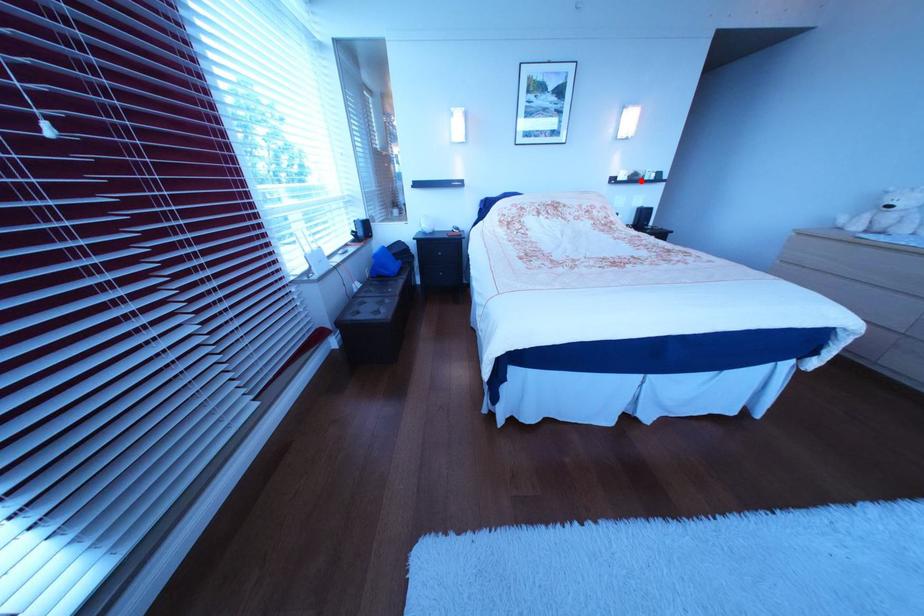
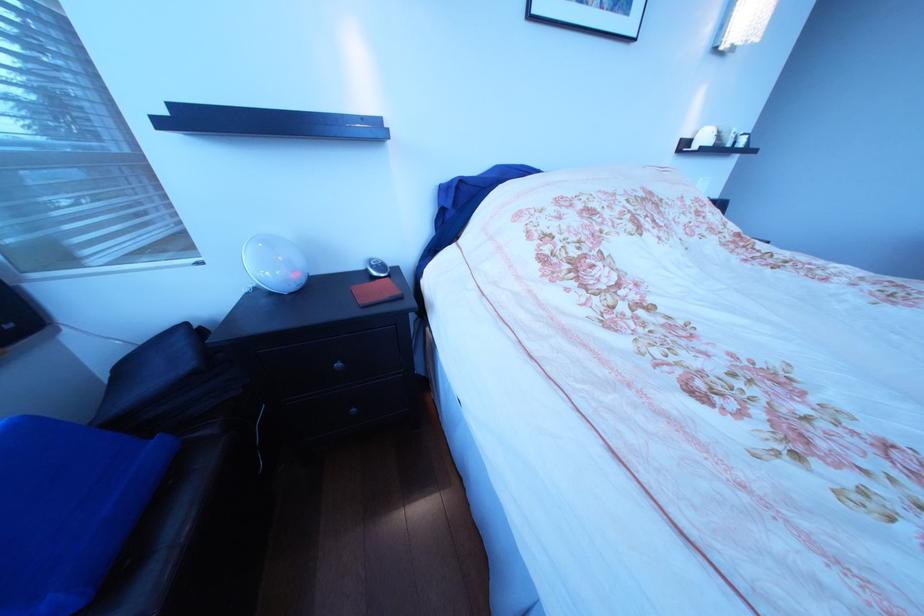
Question: I am providing you with two images of the same scene from different viewpoints. Image1 has a red point marked. In image2, the corresponding 3D location appears at what relative position? Reply with the corresponding letter.

Choices:
 (A) Closer
 (B) Farther

Answer: (B)